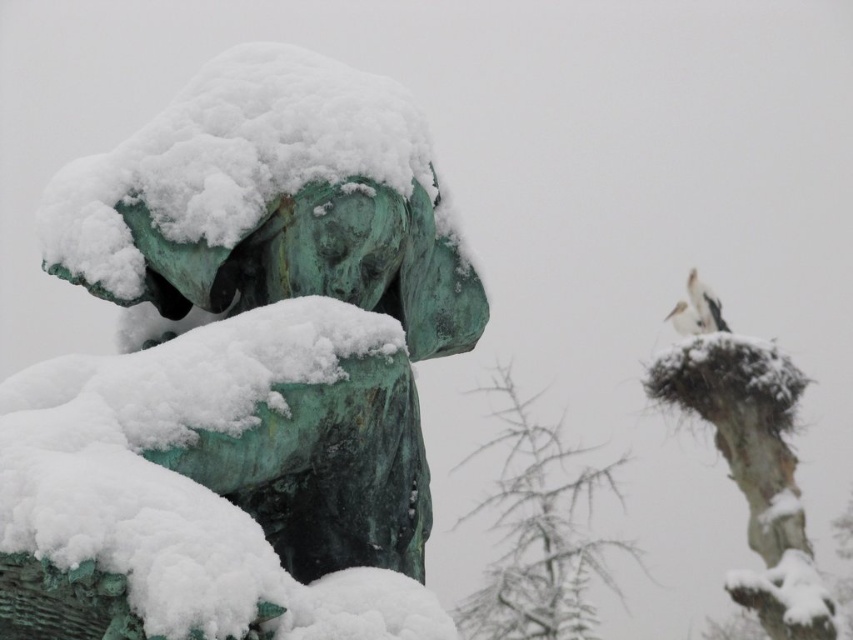
Question: Which is farther from the green patina statue at center?

Choices:
 (A) white feathered bird at upper right
 (B) white matte bird at upper right

Answer: (A)

Question: Is green patina statue at center positioned in front of white matte bird at upper right?

Choices:
 (A) yes
 (B) no

Answer: (A)

Question: Estimate the real-world distances between objects in this image. Which object is closer to the white matte bird at upper right?

Choices:
 (A) white feathered bird at upper right
 (B) green patina statue at center

Answer: (A)

Question: Does white matte bird at upper right have a smaller size compared to white feathered bird at upper right?

Choices:
 (A) yes
 (B) no

Answer: (B)

Question: Which object is farther from the camera taking this photo?

Choices:
 (A) green patina statue at center
 (B) white matte bird at upper right

Answer: (B)

Question: Does green patina statue at center appear under white matte bird at upper right?

Choices:
 (A) no
 (B) yes

Answer: (A)